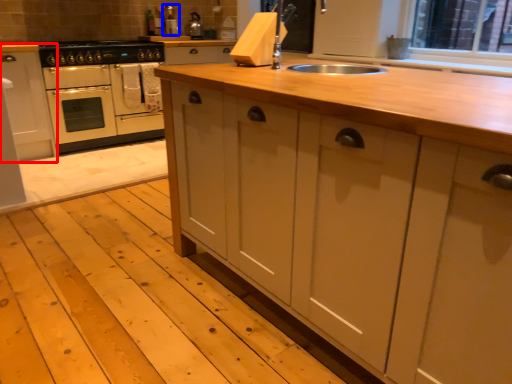
Question: Which of the following is the closest to the observer, cabinetry (highlighted by a red box) or appliance (highlighted by a blue box)?

Choices:
 (A) cabinetry
 (B) appliance

Answer: (A)